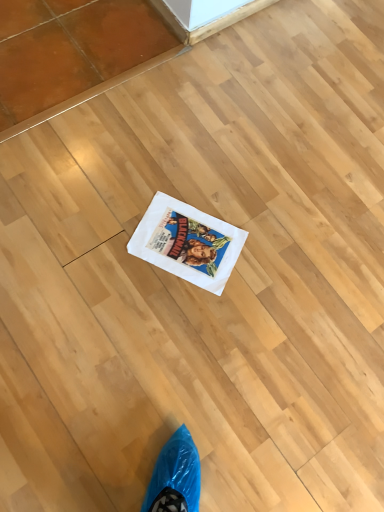
Find the location of `unoccupied area behind white paper comic book at center`. unoccupied area behind white paper comic book at center is located at coordinates (215, 174).